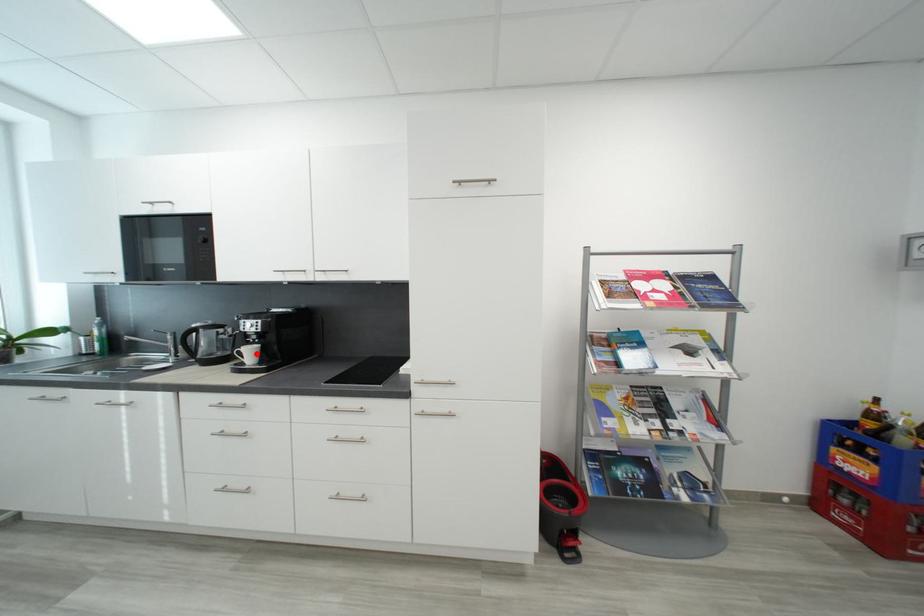
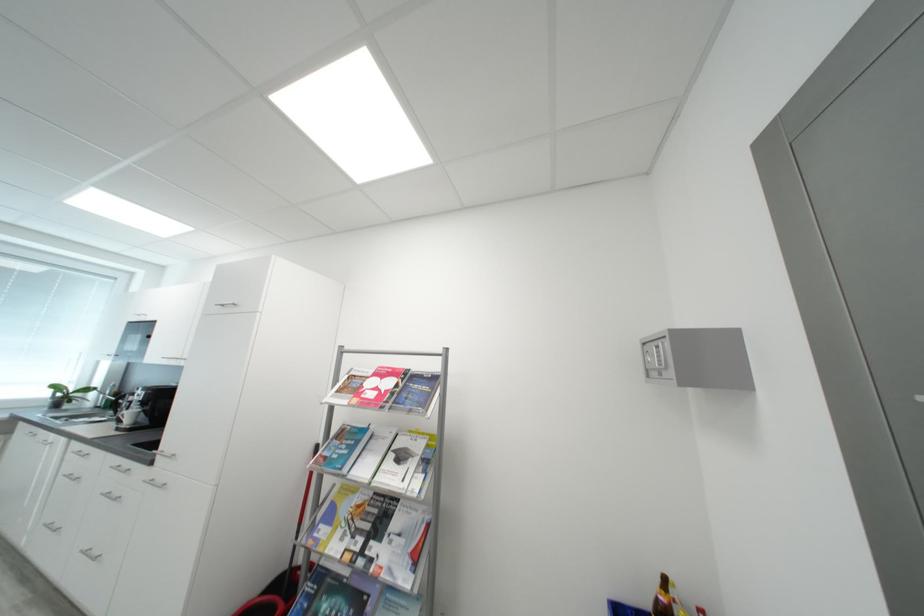
Question: I am providing you with two images of the same scene from different viewpoints. A red point is shown in image1. For the corresponding object point in image2, is it positioned nearer or farther from the camera?

Choices:
 (A) Nearer
 (B) Farther

Answer: (A)